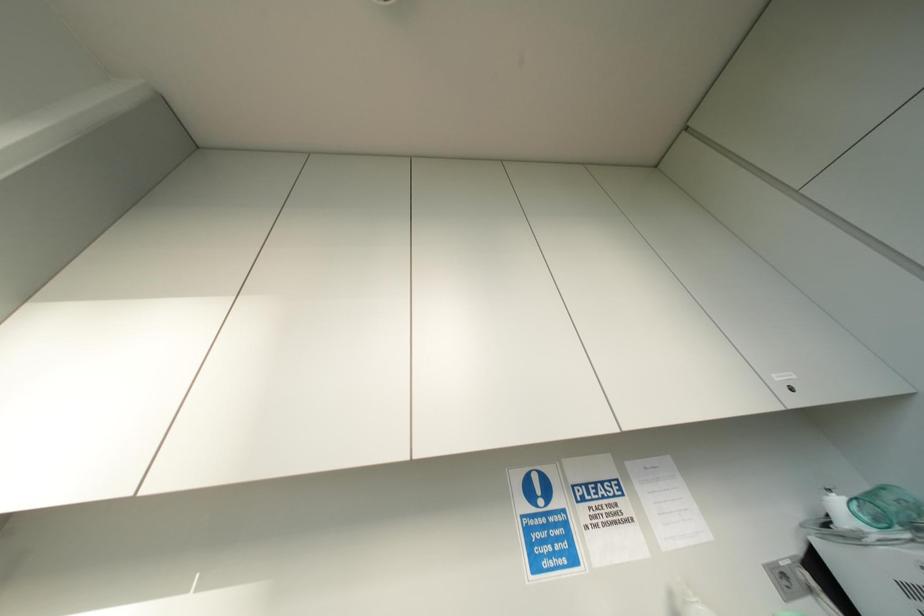
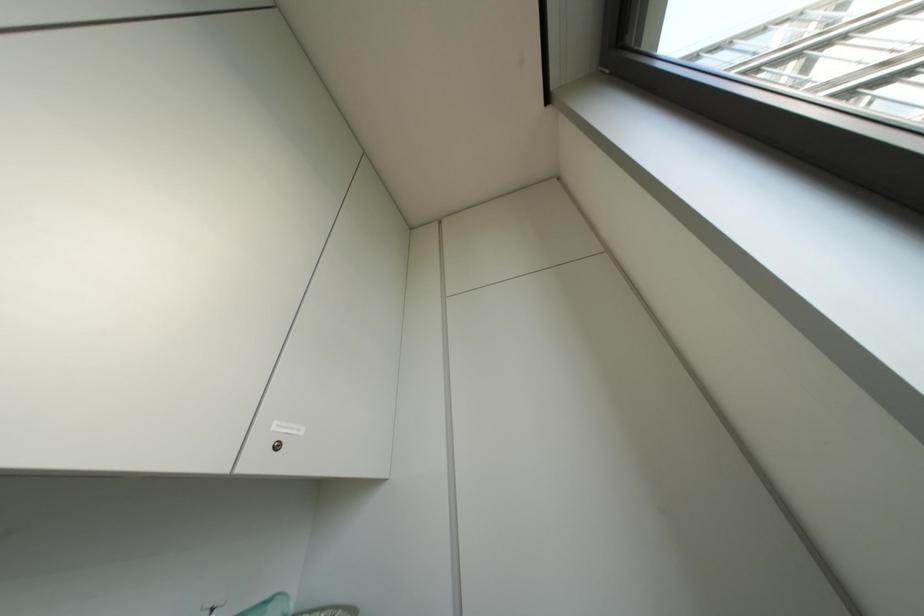
How did the camera likely rotate?

The rotation direction of the camera is right-up.